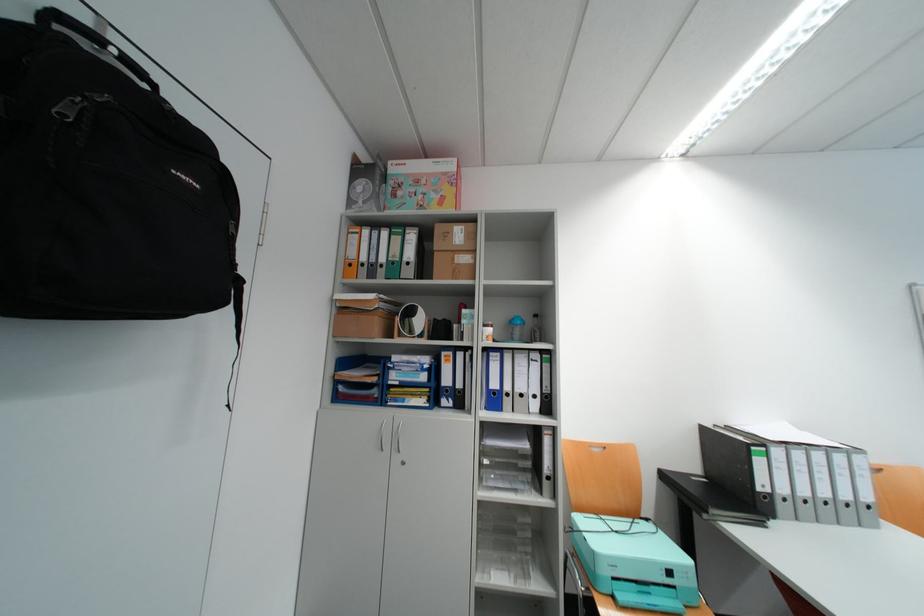
The image size is (924, 616). What do you see at coordinates (533, 395) in the screenshot? I see `a white binder spine hole` at bounding box center [533, 395].